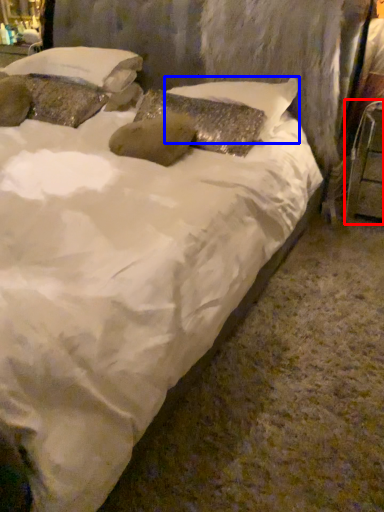
Question: Which of the following is the closest to the observer, furniture (highlighted by a red box) or pillow (highlighted by a blue box)?

Choices:
 (A) furniture
 (B) pillow

Answer: (B)